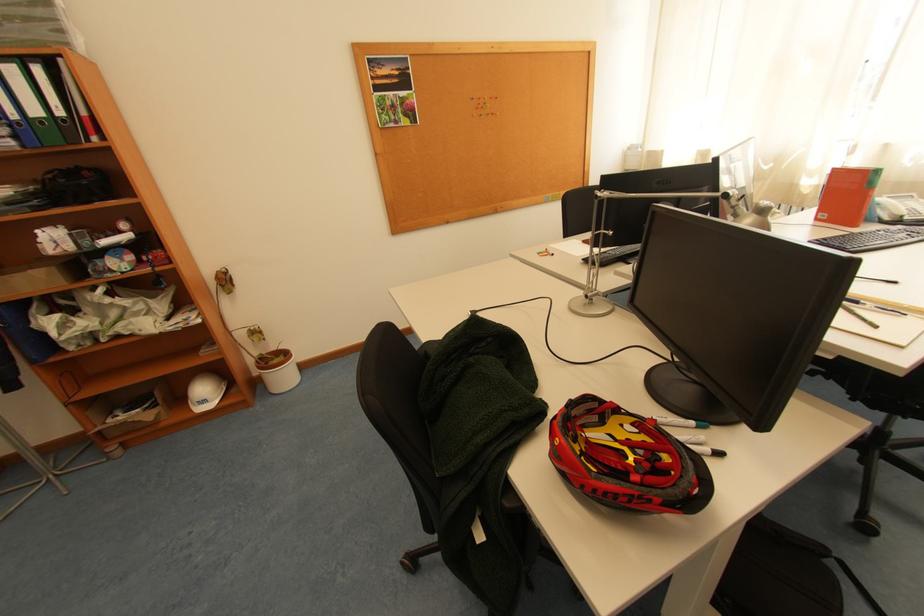
Locate an element on the screen. This screenshot has width=924, height=616. red book is located at coordinates (845, 196).